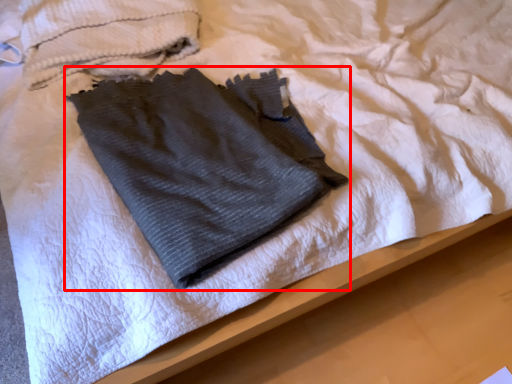
Question: Considering the relative positions of towel (annotated by the red box) and towel in the image provided, where is towel (annotated by the red box) located with respect to the staircase?

Choices:
 (A) left
 (B) right

Answer: (B)